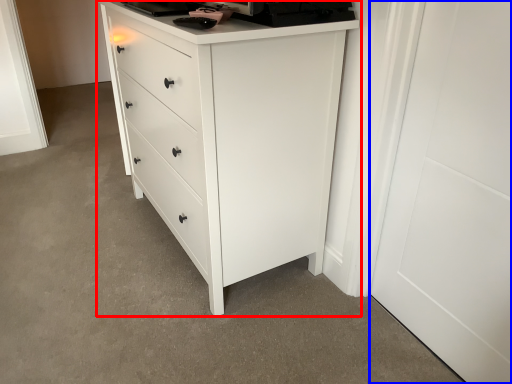
Question: Among these objects, which one is farthest to the camera, chest of drawers (highlighted by a red box) or door (highlighted by a blue box)?

Choices:
 (A) chest of drawers
 (B) door

Answer: (A)